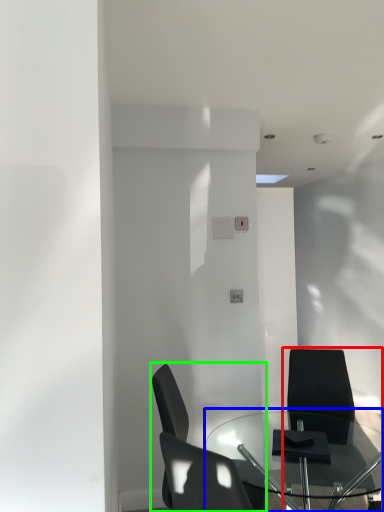
Question: Estimate the real-world distances between objects in this image. Which object is closer to chair (highlighted by a red box), table (highlighted by a blue box) or chair (highlighted by a green box)?

Choices:
 (A) table
 (B) chair

Answer: (A)